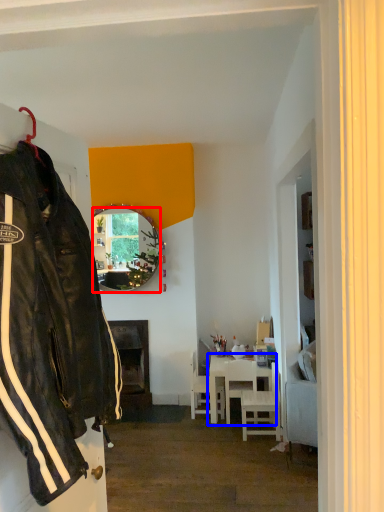
Question: Which object appears farthest to the camera in this image, mirror (highlighted by a red box) or table (highlighted by a blue box)?

Choices:
 (A) mirror
 (B) table

Answer: (A)